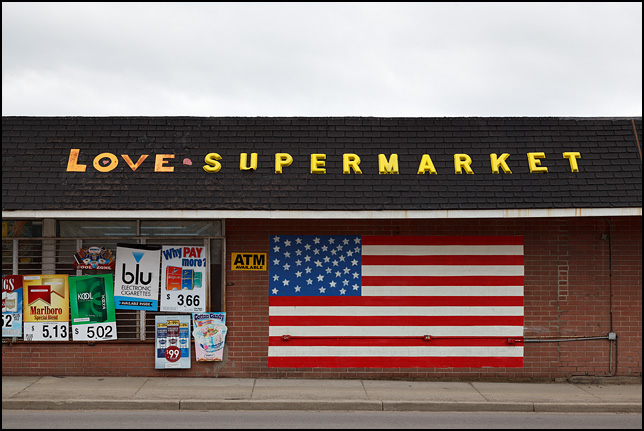
Find the location of `retail store sales posters`. retail store sales posters is located at coordinates (89, 292), (138, 281), (184, 279), (178, 328), (209, 337), (37, 304), (13, 300).